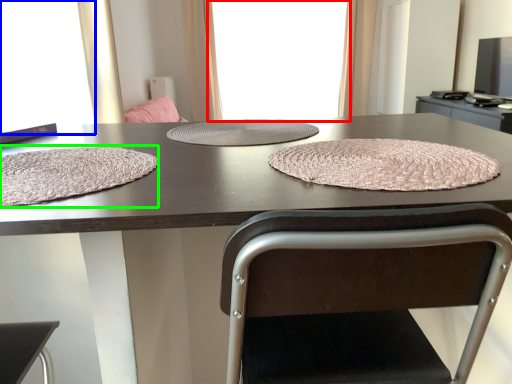
Question: Which object is positioned farthest from window screen (highlighted by a red box)? Select from window screen (highlighted by a blue box) and blanket (highlighted by a green box).

Choices:
 (A) window screen
 (B) blanket

Answer: (B)